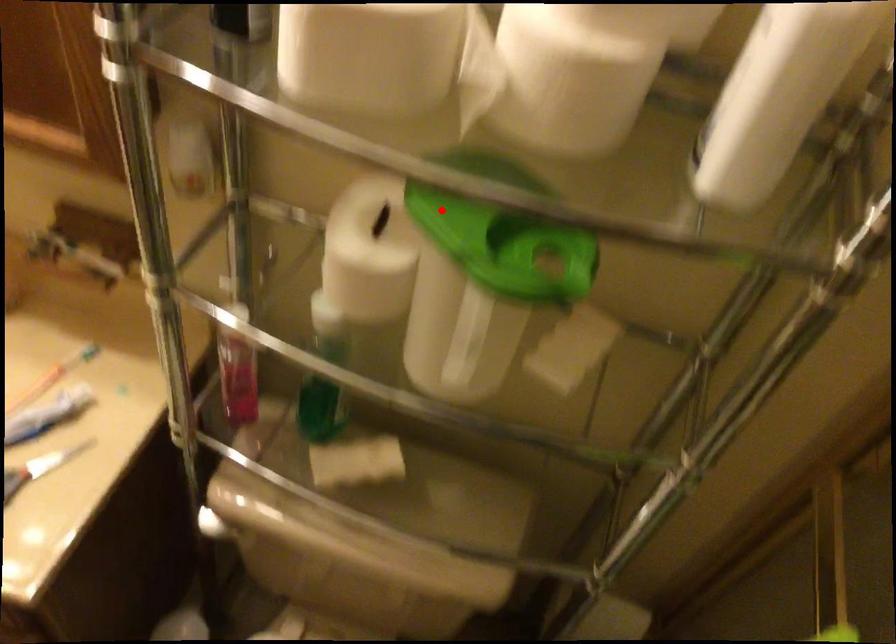
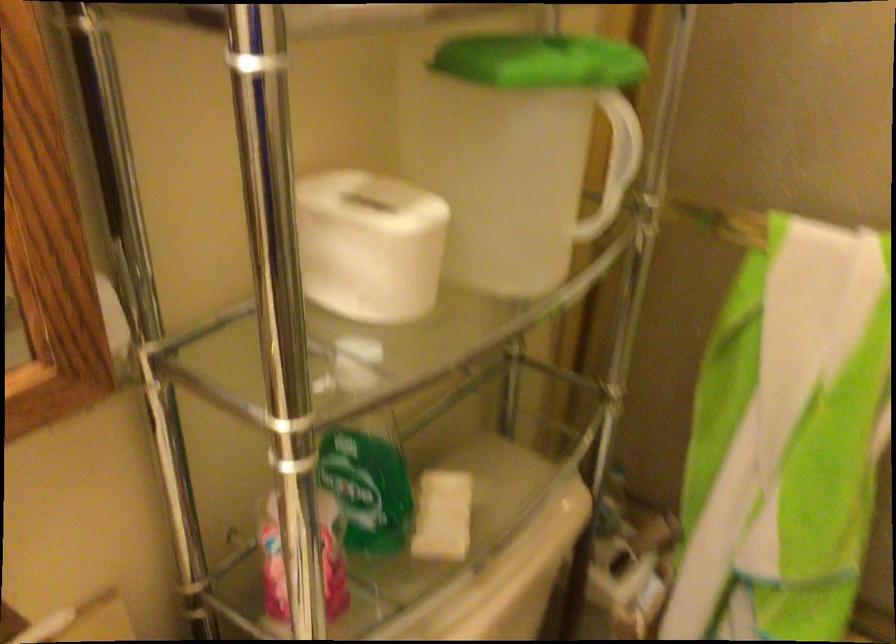
In the second image, find the point that corresponds to the highlighted location in the first image.

(539, 61)